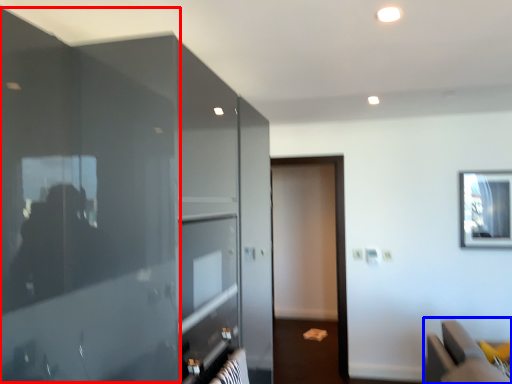
Question: Which object is closer to the camera taking this photo, glass door (highlighted by a red box) or furniture (highlighted by a blue box)?

Choices:
 (A) glass door
 (B) furniture

Answer: (A)